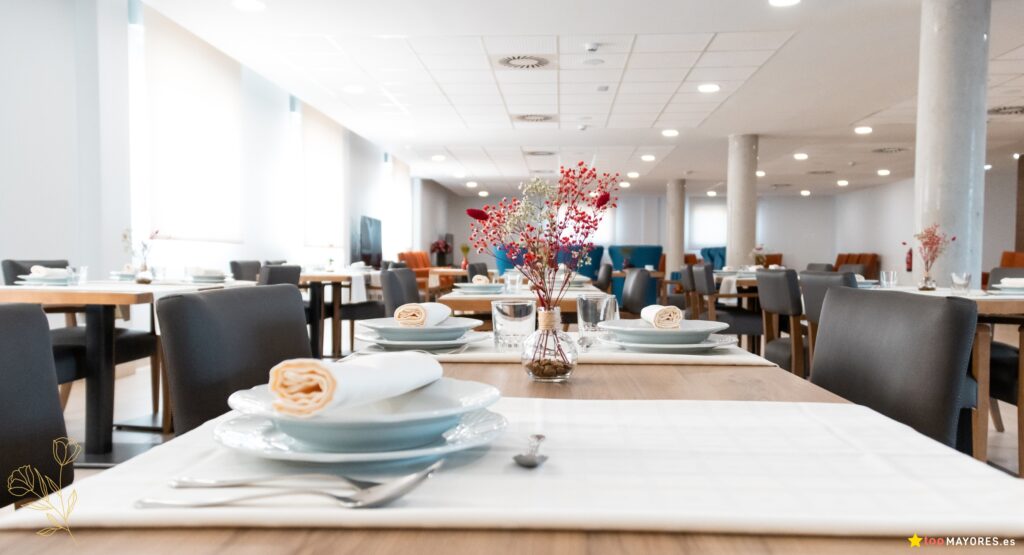
Locate an element on the screen. This screenshot has width=1024, height=555. flower arrangements is located at coordinates (546, 355), (140, 271), (921, 279), (461, 263).